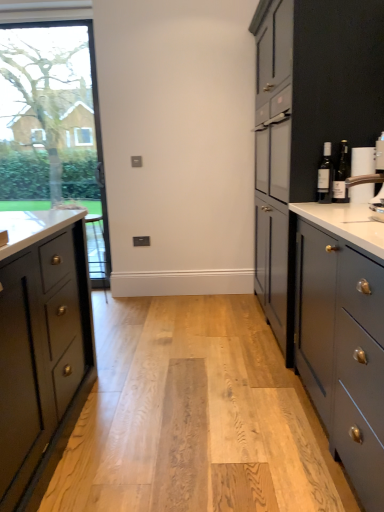
Question: Is matte gray cabinets at right shorter than white glossy coffee machine at upper right?

Choices:
 (A) no
 (B) yes

Answer: (A)

Question: Can you confirm if matte gray cabinets at right is smaller than white glossy coffee machine at upper right?

Choices:
 (A) no
 (B) yes

Answer: (A)

Question: Are matte gray cabinets at right and white glossy coffee machine at upper right located far from each other?

Choices:
 (A) no
 (B) yes

Answer: (A)

Question: From a real-world perspective, is matte gray cabinets at right located beneath white glossy coffee machine at upper right?

Choices:
 (A) no
 (B) yes

Answer: (B)

Question: Considering the relative positions of matte gray cabinets at right and white glossy coffee machine at upper right in the image provided, is matte gray cabinets at right to the left of white glossy coffee machine at upper right from the viewer's perspective?

Choices:
 (A) yes
 (B) no

Answer: (B)

Question: Choose the correct answer: Is matte glass bottle at right, which is counted as the 2th bottle, starting from the right, inside white glossy coffee machine at upper right or outside it?

Choices:
 (A) outside
 (B) inside

Answer: (A)

Question: In terms of height, does matte glass bottle at right, acting as the first bottle starting from the left, look taller or shorter compared to white glossy coffee machine at upper right?

Choices:
 (A) tall
 (B) short

Answer: (A)

Question: From a real-world perspective, is matte glass bottle at right, which is counted as the 2th bottle, starting from the right, physically located above or below white glossy coffee machine at upper right?

Choices:
 (A) above
 (B) below

Answer: (A)

Question: Looking at their shapes, would you say matte glass bottle at right, acting as the first bottle starting from the left, is wider or thinner than white glossy coffee machine at upper right?

Choices:
 (A) wide
 (B) thin

Answer: (B)

Question: Is point (317, 194) closer or farther from the camera than point (14, 196)?

Choices:
 (A) farther
 (B) closer

Answer: (B)

Question: From a real-world perspective, relative to clear glass window at left, is matte glass bottle at right, which is counted as the 2th bottle, starting from the right, vertically above or below?

Choices:
 (A) below
 (B) above

Answer: (A)

Question: In terms of width, does matte glass bottle at right, which is counted as the 2th bottle, starting from the right, look wider or thinner when compared to clear glass window at left?

Choices:
 (A) wide
 (B) thin

Answer: (B)

Question: In terms of size, does matte glass bottle at right, which is counted as the 2th bottle, starting from the right, appear bigger or smaller than clear glass window at left?

Choices:
 (A) big
 (B) small

Answer: (B)

Question: From the image's perspective, is clear glass window at left above or below matte gray cabinets at right?

Choices:
 (A) below
 (B) above

Answer: (B)

Question: Would you say clear glass window at left is inside or outside matte gray cabinets at right?

Choices:
 (A) outside
 (B) inside

Answer: (A)